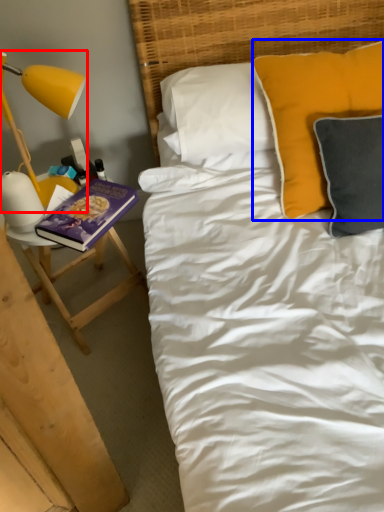
Question: Which of the following is the closest to the observer, lamp (highlighted by a red box) or pillow (highlighted by a blue box)?

Choices:
 (A) lamp
 (B) pillow

Answer: (B)